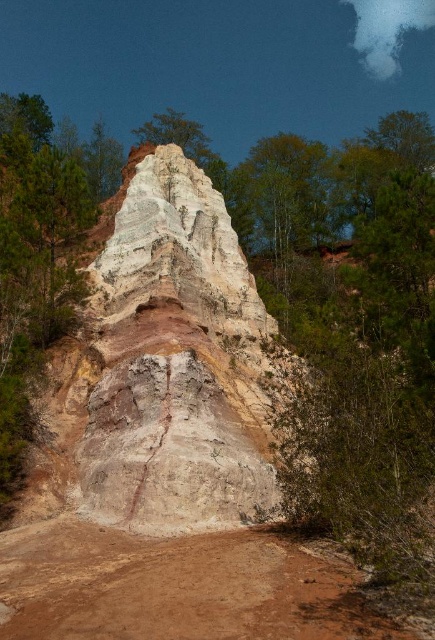
Question: Can you confirm if smooth sandstone rock at center is thinner than brown sandy dirt track at lower center?

Choices:
 (A) no
 (B) yes

Answer: (B)

Question: Which point appears closest to the camera in this image?

Choices:
 (A) (110, 388)
 (B) (253, 592)

Answer: (B)

Question: Does smooth sandstone rock at center have a lesser width compared to brown sandy dirt track at lower center?

Choices:
 (A) yes
 (B) no

Answer: (A)

Question: Can you confirm if smooth sandstone rock at center is positioned below brown sandy dirt track at lower center?

Choices:
 (A) no
 (B) yes

Answer: (A)